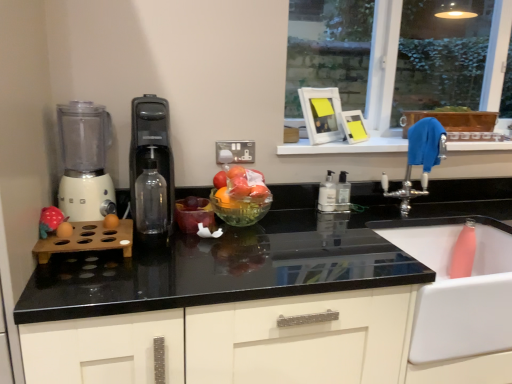
Question: From a real-world perspective, is transparent glass bottle at center, which appears as the first bottle when viewed from the front, above or below white matte blender at left?

Choices:
 (A) above
 (B) below

Answer: (B)

Question: Is transparent glass bottle at center, positioned as the 3th bottle in back-to-front order, taller or shorter than white matte blender at left?

Choices:
 (A) tall
 (B) short

Answer: (B)

Question: Considering the real-world distances, which object is farthest from the transparent glass bottle at center, arranged as the 3th bottle when viewed from the right?

Choices:
 (A) silver metallic faucet at upper right
 (B) white plastic pump bottle at center, placed as the 2th bottle when sorted from back to front
 (C) black glossy countertop at center
 (D) white matte blender at left
 (E) transparent glass bowl at center

Answer: (A)

Question: Considering the real-world distances, which object is closest to the black plastic water dispenser at center?

Choices:
 (A) white matte blender at left
 (B) clear plastic soap dispenser at center, the first bottle positioned from the right
 (C) transparent glass window at upper right
 (D) transparent glass bowl at center
 (E) blue fabric at upper right

Answer: (A)